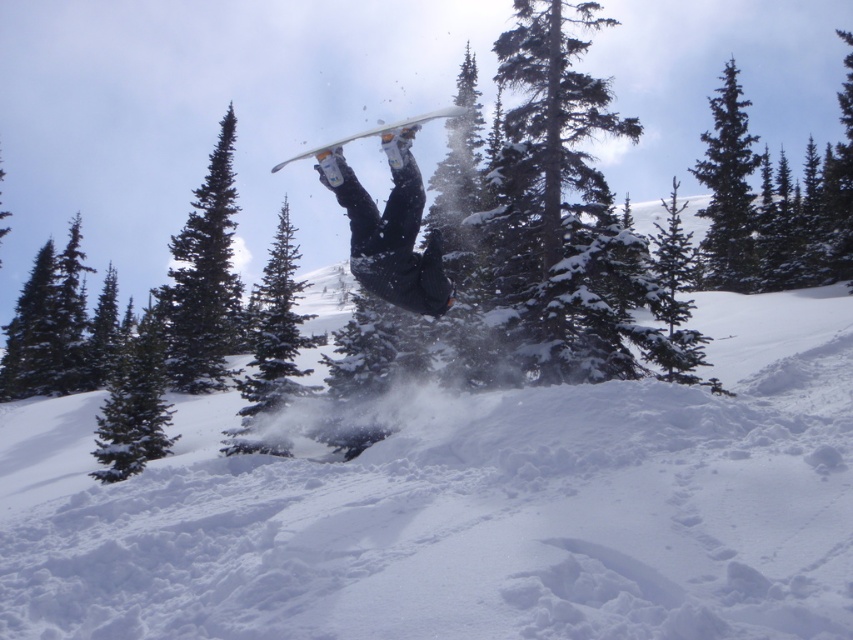
Question: From the image, what is the correct spatial relationship of white fluffy snow at center in relation to white glossy snowboard at center?

Choices:
 (A) right
 (B) left

Answer: (A)

Question: Among these points, which one is farthest from the camera?

Choices:
 (A) (199, 192)
 (B) (737, 266)

Answer: (B)

Question: Can you confirm if green matte tree at upper left is positioned below green matte tree at upper right?

Choices:
 (A) yes
 (B) no

Answer: (A)

Question: Among these objects, which one is farthest from the camera?

Choices:
 (A) white fluffy snow at center
 (B) snow-covered evergreen tree at center
 (C) green matte tree at center
 (D) green matte tree at upper left

Answer: (D)

Question: Based on their relative distances, which object is nearer to the snow-covered evergreen tree at center?

Choices:
 (A) green matte tree at upper right
 (B) white fluffy snow at center

Answer: (A)

Question: Does white fluffy snow at center appear under snow-covered evergreen tree at center?

Choices:
 (A) yes
 (B) no

Answer: (A)